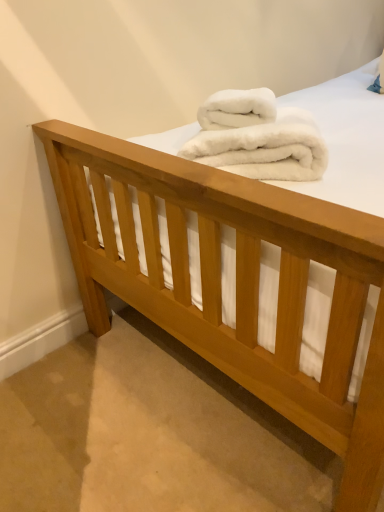
Measure the distance between white fluffy towels at center, which appears as the first towel when ordered from the bottom, and camera.

A distance of 32.47 inches exists between white fluffy towels at center, which appears as the first towel when ordered from the bottom, and camera.

How much space does white fluffy towels at center, which appears as the first towel when ordered from the bottom, occupy horizontally?

40.57 centimeters.

At what (x,y) coordinates should I click in order to perform the action: click on white fluffy towels at center, which appears as the first towel when ordered from the bottom. Please return your answer as a coordinate pair (x, y). The width and height of the screenshot is (384, 512). Looking at the image, I should click on (264, 148).

What do you see at coordinates (264, 148) in the screenshot?
I see `white fluffy towels at center, which appears as the first towel when ordered from the bottom` at bounding box center [264, 148].

You are a GUI agent. You are given a task and a screenshot of the screen. Output one action in this format:
    pyautogui.click(x=<x>, y=<y>)
    Task: Click on the white fluffy towel at center, which is the second towel in bottom-to-top order
    This screenshot has width=384, height=512.
    Given the screenshot: What is the action you would take?
    pyautogui.click(x=237, y=109)

Describe the element at coordinates (237, 109) in the screenshot. I see `white fluffy towel at center, which is the second towel in bottom-to-top order` at that location.

Identify the location of white fluffy towels at center, which appears as the first towel when ordered from the bottom. The width and height of the screenshot is (384, 512). (264, 148).

Between white fluffy towels at center, which appears as the first towel when ordered from the bottom, and white fluffy towel at center, which is the second towel in bottom-to-top order, which one appears on the right side from the viewer's perspective?

Positioned to the right is white fluffy towels at center, which appears as the first towel when ordered from the bottom.

Considering the positions of objects white fluffy towels at center, placed as the 2th towel when sorted from top to bottom, and white fluffy towel at center, acting as the first towel starting from the top, in the image provided, who is in front, white fluffy towels at center, placed as the 2th towel when sorted from top to bottom, or white fluffy towel at center, acting as the first towel starting from the top,?

white fluffy towels at center, placed as the 2th towel when sorted from top to bottom, is more forward.

Is point (198, 155) positioned before point (224, 122)?

That is True.

From the image's perspective, which one is positioned lower, white fluffy towels at center, placed as the 2th towel when sorted from top to bottom, or white fluffy towel at center, acting as the first towel starting from the top?

white fluffy towels at center, placed as the 2th towel when sorted from top to bottom, is shown below in the image.

From a real-world perspective, which is physically above, white fluffy towels at center, which appears as the first towel when ordered from the bottom, or white fluffy towel at center, acting as the first towel starting from the top?

white fluffy towel at center, acting as the first towel starting from the top.

Considering the relative sizes of white fluffy towels at center, placed as the 2th towel when sorted from top to bottom, and white fluffy towel at center, which is the second towel in bottom-to-top order, in the image provided, is white fluffy towels at center, placed as the 2th towel when sorted from top to bottom, thinner than white fluffy towel at center, which is the second towel in bottom-to-top order,?

In fact, white fluffy towels at center, placed as the 2th towel when sorted from top to bottom, might be wider than white fluffy towel at center, which is the second towel in bottom-to-top order.

Looking at this image, considering the sizes of white fluffy towels at center, which appears as the first towel when ordered from the bottom, and white fluffy towel at center, which is the second towel in bottom-to-top order, in the image, is white fluffy towels at center, which appears as the first towel when ordered from the bottom, taller or shorter than white fluffy towel at center, which is the second towel in bottom-to-top order,?

Considering their sizes, white fluffy towels at center, which appears as the first towel when ordered from the bottom, has more height than white fluffy towel at center, which is the second towel in bottom-to-top order.

Can you confirm if white fluffy towels at center, which appears as the first towel when ordered from the bottom, is bigger than white fluffy towel at center, acting as the first towel starting from the top?

Indeed, white fluffy towels at center, which appears as the first towel when ordered from the bottom, has a larger size compared to white fluffy towel at center, acting as the first towel starting from the top.

Would you say white fluffy towels at center, which appears as the first towel when ordered from the bottom, contains white fluffy towel at center, which is the second towel in bottom-to-top order?

Absolutely, white fluffy towel at center, which is the second towel in bottom-to-top order, is inside white fluffy towels at center, which appears as the first towel when ordered from the bottom.

Can you see white fluffy towels at center, placed as the 2th towel when sorted from top to bottom, touching white fluffy towel at center, acting as the first towel starting from the top?

Yes, white fluffy towels at center, placed as the 2th towel when sorted from top to bottom, is beside white fluffy towel at center, acting as the first towel starting from the top.

Is white fluffy towels at center, placed as the 2th towel when sorted from top to bottom, facing towards white fluffy towel at center, acting as the first towel starting from the top?

No, white fluffy towels at center, placed as the 2th towel when sorted from top to bottom, is not aimed at white fluffy towel at center, acting as the first towel starting from the top.

Can you tell me how much white fluffy towels at center, which appears as the first towel when ordered from the bottom, and white fluffy towel at center, which is the second towel in bottom-to-top order, differ in facing direction?

The angular difference between white fluffy towels at center, which appears as the first towel when ordered from the bottom, and white fluffy towel at center, which is the second towel in bottom-to-top order, is 0.0509 degrees.

How much distance is there between white fluffy towels at center, which appears as the first towel when ordered from the bottom, and white fluffy towel at center, acting as the first towel starting from the top?

A distance of 8.71 centimeters exists between white fluffy towels at center, which appears as the first towel when ordered from the bottom, and white fluffy towel at center, acting as the first towel starting from the top.

You are a GUI agent. You are given a task and a screenshot of the screen. Output one action in this format:
    pyautogui.click(x=<x>, y=<y>)
    Task: Click on the towel located in front of the white fluffy towel at center, acting as the first towel starting from the top
    
    Given the screenshot: What is the action you would take?
    pyautogui.click(x=264, y=148)

Is white fluffy towel at center, acting as the first towel starting from the top, to the left of white fluffy towels at center, placed as the 2th towel when sorted from top to bottom, from the viewer's perspective?

Indeed, white fluffy towel at center, acting as the first towel starting from the top, is positioned on the left side of white fluffy towels at center, placed as the 2th towel when sorted from top to bottom.

Is white fluffy towel at center, acting as the first towel starting from the top, in front of white fluffy towels at center, which appears as the first towel when ordered from the bottom?

That is False.

Which is more distant, [242,115] or [277,124]?

Point [242,115]

From the image's perspective, is white fluffy towel at center, which is the second towel in bottom-to-top order, over white fluffy towels at center, which appears as the first towel when ordered from the bottom?

Yes, from the image's perspective, white fluffy towel at center, which is the second towel in bottom-to-top order, is on top of white fluffy towels at center, which appears as the first towel when ordered from the bottom.

From a real-world perspective, is white fluffy towel at center, which is the second towel in bottom-to-top order, positioned above or below white fluffy towels at center, placed as the 2th towel when sorted from top to bottom?

white fluffy towel at center, which is the second towel in bottom-to-top order, is situated higher than white fluffy towels at center, placed as the 2th towel when sorted from top to bottom, in the real world.

Which object is thinner, white fluffy towel at center, acting as the first towel starting from the top, or white fluffy towels at center, placed as the 2th towel when sorted from top to bottom?

Thinner between the two is white fluffy towel at center, acting as the first towel starting from the top.

Can you confirm if white fluffy towel at center, which is the second towel in bottom-to-top order, is taller than white fluffy towels at center, which appears as the first towel when ordered from the bottom?

In fact, white fluffy towel at center, which is the second towel in bottom-to-top order, may be shorter than white fluffy towels at center, which appears as the first towel when ordered from the bottom.

Is white fluffy towel at center, acting as the first towel starting from the top, bigger than white fluffy towels at center, which appears as the first towel when ordered from the bottom?

No.

Looking at this image, do you think white fluffy towel at center, which is the second towel in bottom-to-top order, is within white fluffy towels at center, placed as the 2th towel when sorted from top to bottom, or outside of it?

white fluffy towel at center, which is the second towel in bottom-to-top order, can be found inside white fluffy towels at center, placed as the 2th towel when sorted from top to bottom.

Would you consider white fluffy towel at center, acting as the first towel starting from the top, to be distant from white fluffy towels at center, placed as the 2th towel when sorted from top to bottom?

They are positioned close to each other.

Is white fluffy towel at center, which is the second towel in bottom-to-top order, positioned with its back to white fluffy towels at center, which appears as the first towel when ordered from the bottom?

That's right, white fluffy towel at center, which is the second towel in bottom-to-top order, is facing away from white fluffy towels at center, which appears as the first towel when ordered from the bottom.

What's the angular difference between white fluffy towel at center, which is the second towel in bottom-to-top order, and white fluffy towels at center, placed as the 2th towel when sorted from top to bottom,'s facing directions?

They differ by 0.0509 degrees in their facing directions.

In order to click on towel in front of the white fluffy towel at center, which is the second towel in bottom-to-top order in this screenshot , I will do `click(264, 148)`.

This screenshot has height=512, width=384. In the image, there is a white fluffy towel at center, acting as the first towel starting from the top. Find the location of `towel below it (from a real-world perspective)`. towel below it (from a real-world perspective) is located at coordinates (264, 148).

The height and width of the screenshot is (512, 384). What are the coordinates of `towel above the white fluffy towels at center, placed as the 2th towel when sorted from top to bottom (from a real-world perspective)` in the screenshot? It's located at (237, 109).